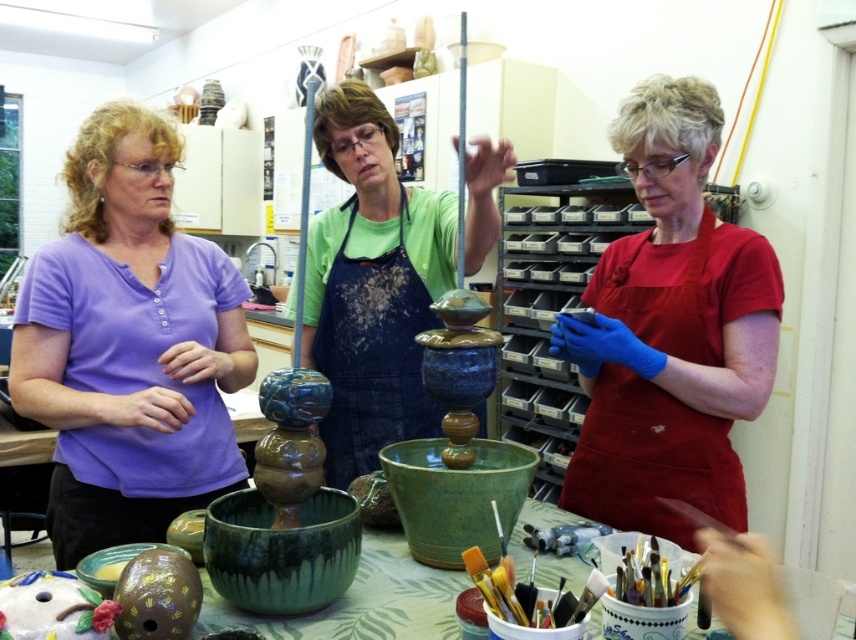
Does purple cotton shirt at left have a greater width compared to blue denim apron at center?

Indeed, purple cotton shirt at left has a greater width compared to blue denim apron at center.

Does purple cotton shirt at left have a lesser width compared to blue denim apron at center?

In fact, purple cotton shirt at left might be wider than blue denim apron at center.

Which is in front, point (28, 385) or point (428, 291)?

Positioned in front is point (28, 385).

At what (x,y) coordinates should I click in order to perform the action: click on purple cotton shirt at left. Please return your answer as a coordinate pair (x, y). The image size is (856, 640). Looking at the image, I should click on (129, 344).

Can you confirm if purple cotton shirt at left is thinner than red matte apron at center?

Incorrect, purple cotton shirt at left's width is not less than red matte apron at center's.

Between point (149, 118) and point (746, 280), which one is positioned behind?

The point (149, 118) is more distant.

Measure the distance between purple cotton shirt at left and camera.

The distance of purple cotton shirt at left from camera is 1.40 meters.

Where is `purple cotton shirt at left`? Image resolution: width=856 pixels, height=640 pixels. purple cotton shirt at left is located at coordinates (129, 344).

Can you confirm if blue glossy vase at center is smaller than blue denim apron at center?

No.

Which is in front, point (403, 378) or point (432, 429)?

Point (432, 429) is in front.

This screenshot has width=856, height=640. What do you see at coordinates (372, 285) in the screenshot? I see `blue glossy vase at center` at bounding box center [372, 285].

Image resolution: width=856 pixels, height=640 pixels. I want to click on blue glossy vase at center, so click(x=372, y=285).